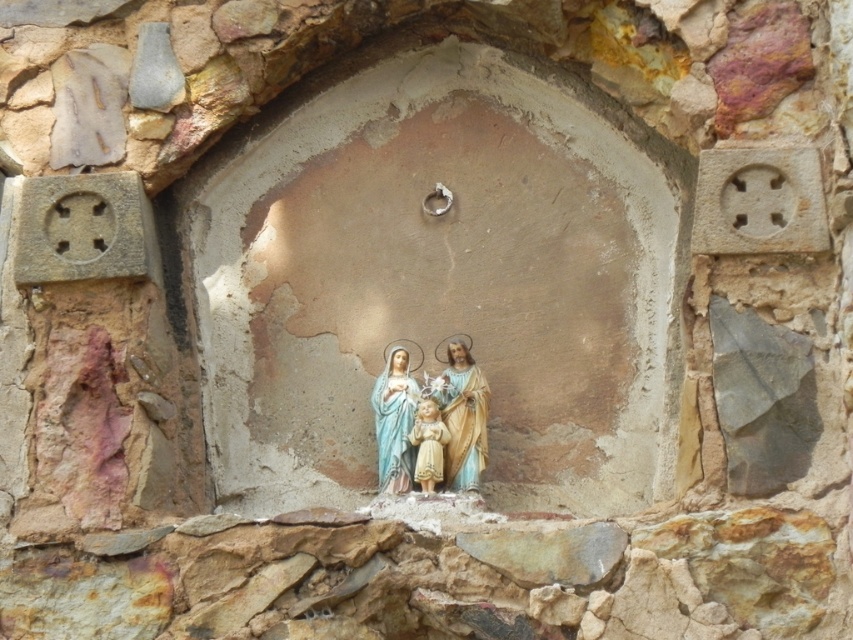
Is the position of matte plastic statue at center more distant than that of smooth beige figurine at center?

That is True.

Can you confirm if matte plastic statue at center is wider than smooth beige figurine at center?

Yes.

Does point (454, 476) lie behind point (428, 451)?

Yes, point (454, 476) is behind point (428, 451).

The image size is (853, 640). Find the location of `matte plastic statue at center`. matte plastic statue at center is located at coordinates (463, 419).

Is point (474, 486) behind point (380, 480)?

No.

Can you confirm if matte plastic statue at center is thinner than matte porcelain holy family at center?

In fact, matte plastic statue at center might be wider than matte porcelain holy family at center.

You are a GUI agent. You are given a task and a screenshot of the screen. Output one action in this format:
    pyautogui.click(x=<x>, y=<y>)
    Task: Click on the matte plastic statue at center
    
    Given the screenshot: What is the action you would take?
    pyautogui.click(x=463, y=419)

Which is below, matte porcelain holy family at center or smooth beige figurine at center?

Positioned lower is smooth beige figurine at center.

This screenshot has height=640, width=853. Describe the element at coordinates (393, 422) in the screenshot. I see `matte porcelain holy family at center` at that location.

The height and width of the screenshot is (640, 853). I want to click on matte porcelain holy family at center, so click(393, 422).